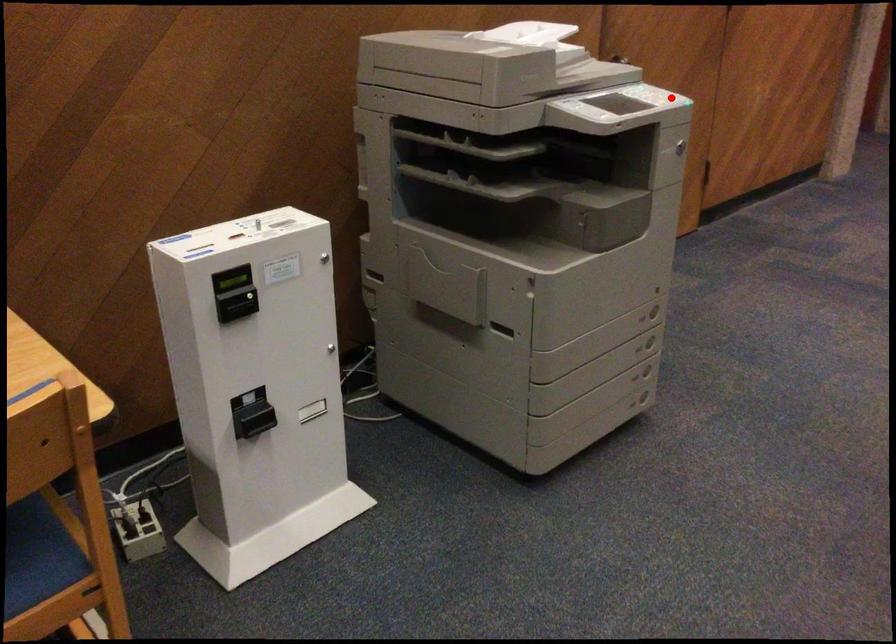
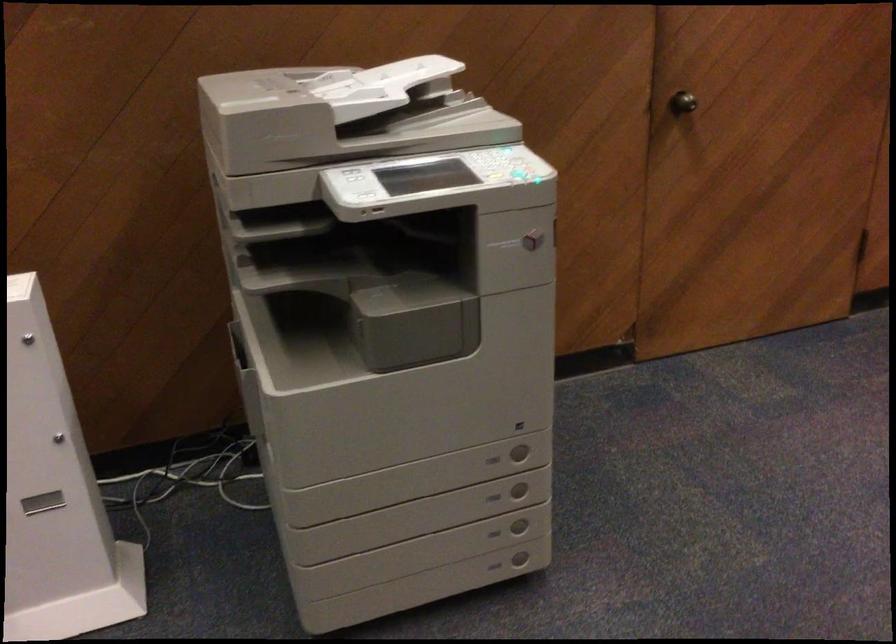
Locate, in the second image, the point that corresponds to the highlighted location in the first image.

(521, 176)